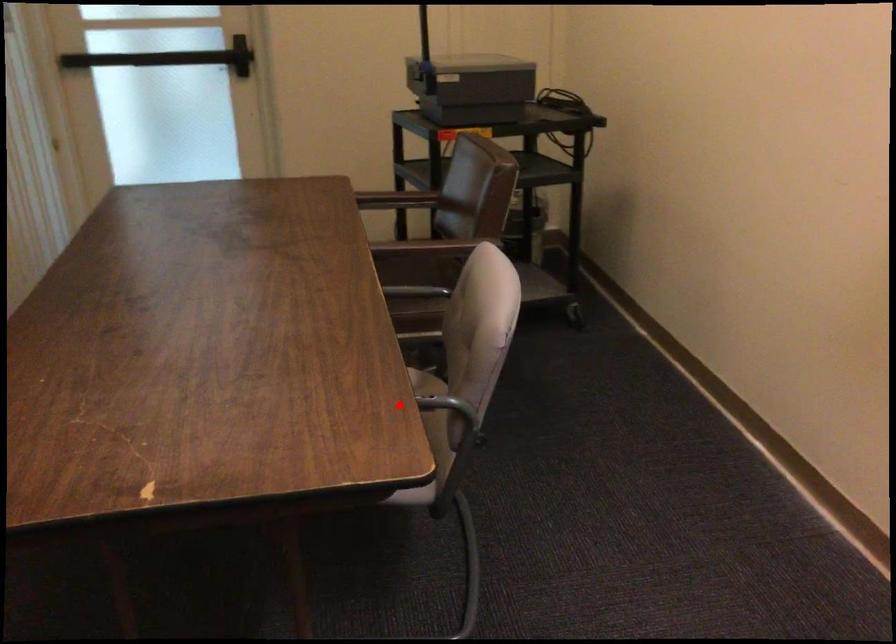
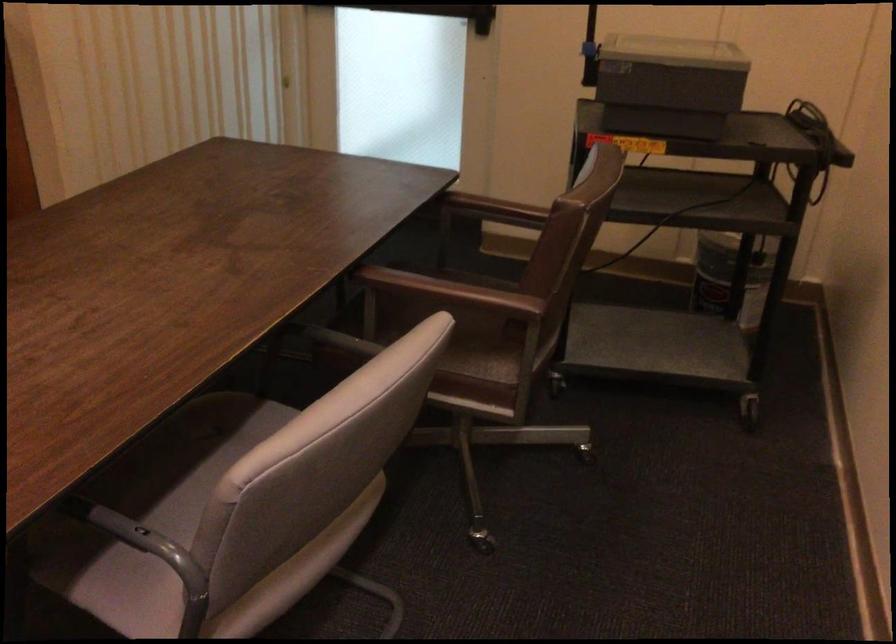
The point at the highlighted location is marked in the first image. Where is the corresponding point in the second image?

(140, 538)